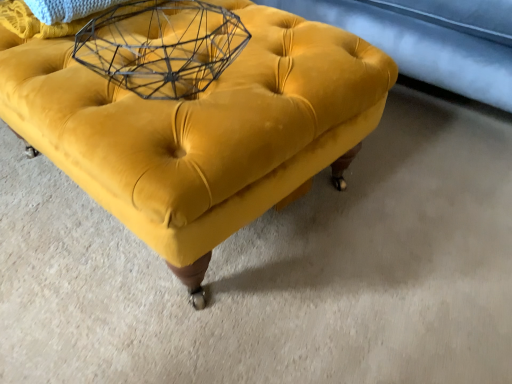
Question: From the image's perspective, is velvet yellow ottoman at center above wire mesh basket at upper center?

Choices:
 (A) yes
 (B) no

Answer: (B)

Question: Considering the relative sizes of velvet yellow ottoman at center and wire mesh basket at upper center in the image provided, is velvet yellow ottoman at center thinner than wire mesh basket at upper center?

Choices:
 (A) yes
 (B) no

Answer: (B)

Question: Can you confirm if velvet yellow ottoman at center is shorter than wire mesh basket at upper center?

Choices:
 (A) yes
 (B) no

Answer: (B)

Question: Are velvet yellow ottoman at center and wire mesh basket at upper center making contact?

Choices:
 (A) no
 (B) yes

Answer: (A)

Question: From the image's perspective, is velvet yellow ottoman at center located beneath wire mesh basket at upper center?

Choices:
 (A) no
 (B) yes

Answer: (B)

Question: From a real-world perspective, does velvet yellow ottoman at center sit lower than wire mesh basket at upper center?

Choices:
 (A) yes
 (B) no

Answer: (A)

Question: Is wire mesh basket at upper center located outside velvet yellow ottoman at center?

Choices:
 (A) no
 (B) yes

Answer: (A)

Question: Could you tell me if wire mesh basket at upper center is facing velvet yellow ottoman at center?

Choices:
 (A) no
 (B) yes

Answer: (A)

Question: Can you confirm if wire mesh basket at upper center is positioned to the left of velvet yellow ottoman at center?

Choices:
 (A) no
 (B) yes

Answer: (B)

Question: Is wire mesh basket at upper center far from velvet yellow ottoman at center?

Choices:
 (A) yes
 (B) no

Answer: (B)

Question: Is wire mesh basket at upper center surrounding velvet yellow ottoman at center?

Choices:
 (A) no
 (B) yes

Answer: (A)

Question: Does wire mesh basket at upper center come in front of velvet yellow ottoman at center?

Choices:
 (A) yes
 (B) no

Answer: (B)

Question: From a real-world perspective, is wire mesh basket at upper center positioned above or below velvet yellow ottoman at center?

Choices:
 (A) above
 (B) below

Answer: (A)